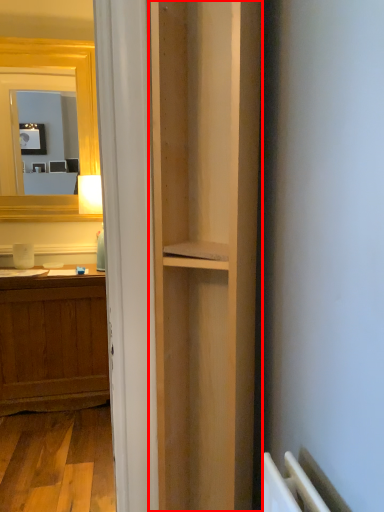
Question: From the image's perspective, what is the correct spatial positioning of bookshelf (annotated by the red box) in reference to corridor?

Choices:
 (A) above
 (B) below

Answer: (A)